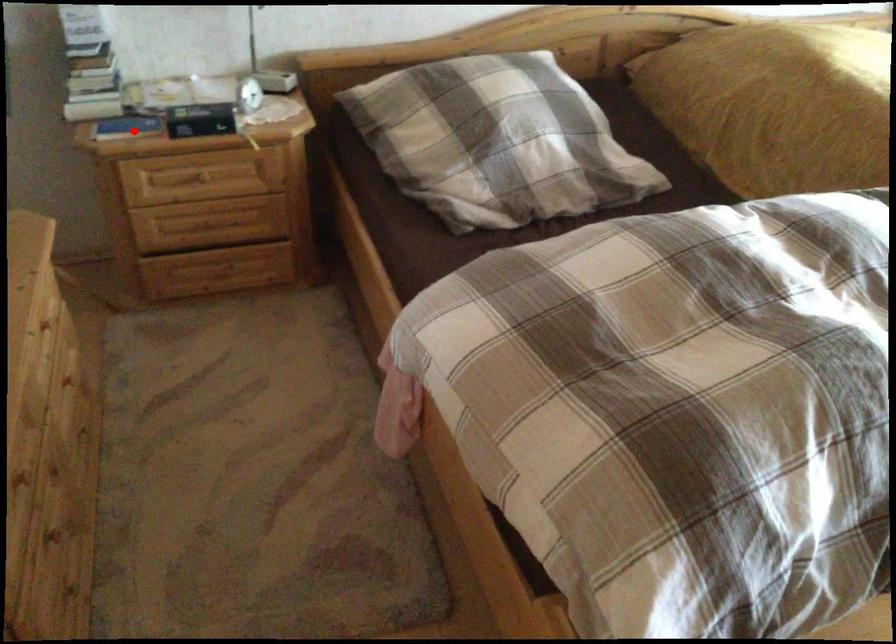
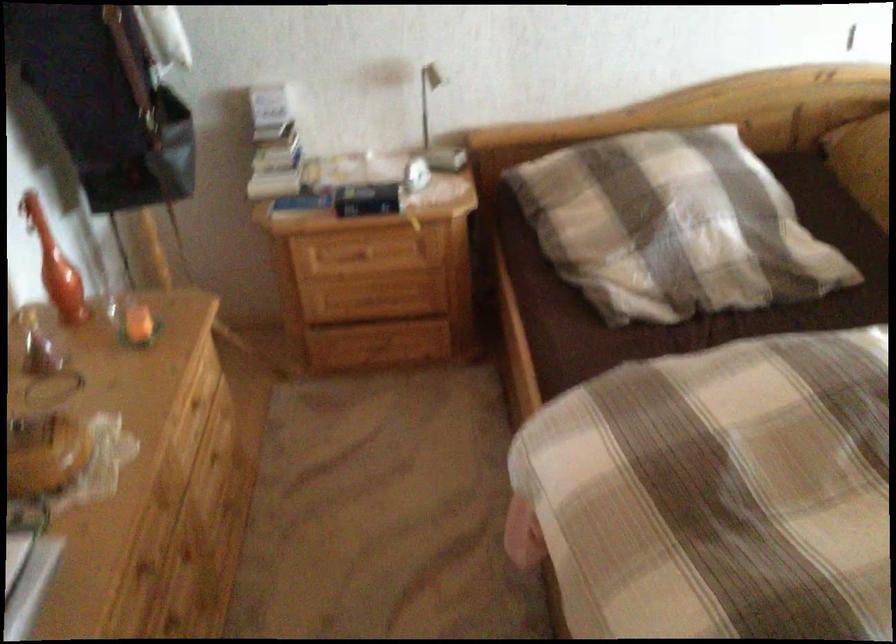
Locate, in the second image, the point that corresponds to the highlighted location in the first image.

(304, 202)